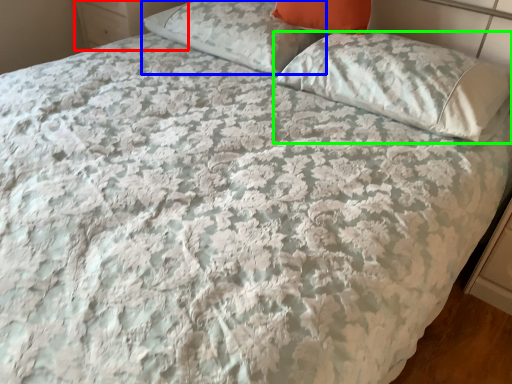
Question: Based on their relative distances, which object is farther from dresser (highlighted by a red box)? Choose from pillow (highlighted by a blue box) and pillow (highlighted by a green box).

Choices:
 (A) pillow
 (B) pillow

Answer: (B)